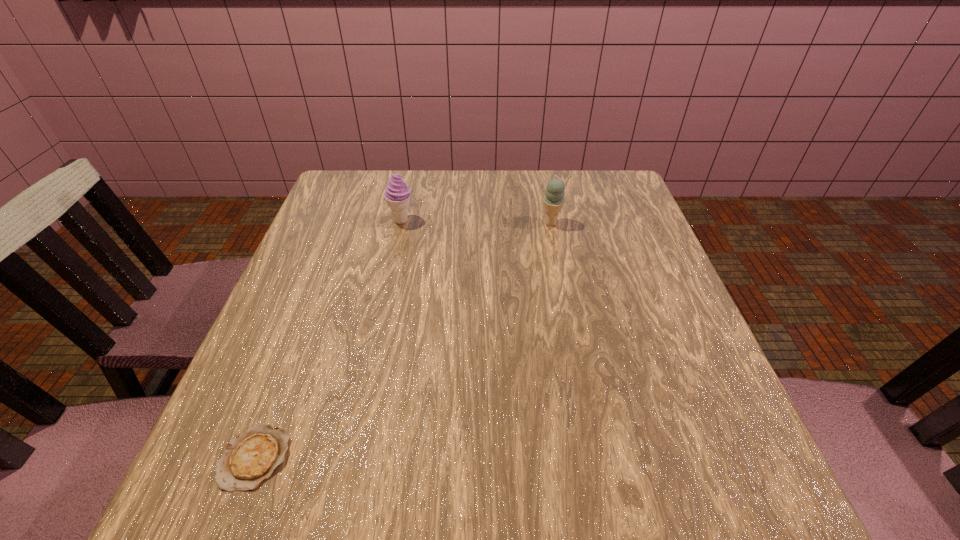
You are a GUI agent. You are given a task and a screenshot of the screen. Output one action in this format:
    pyautogui.click(x=<x>, y=<y>)
    Task: Click on the second object from left to right
    This screenshot has height=540, width=960.
    Given the screenshot: What is the action you would take?
    pyautogui.click(x=397, y=195)

Image resolution: width=960 pixels, height=540 pixels. I want to click on the right ice cream, so click(x=553, y=200).

Where is `the shortest object`? The width and height of the screenshot is (960, 540). the shortest object is located at coordinates (250, 458).

This screenshot has height=540, width=960. Identify the location of the leftmost object. (250, 458).

Locate an element on the screen. The height and width of the screenshot is (540, 960). vacant space located on the right of the second object from left to right is located at coordinates (509, 220).

The height and width of the screenshot is (540, 960). Identify the location of free space located on the left of the right ice cream. (516, 223).

Locate an element on the screen. This screenshot has width=960, height=540. vacant space located on the back of the nearest object is located at coordinates (286, 373).

Locate an element on the screen. Image resolution: width=960 pixels, height=540 pixels. object at the near edge is located at coordinates (250, 458).

Image resolution: width=960 pixels, height=540 pixels. What are the coordinates of `object at the left edge` in the screenshot? It's located at (250, 458).

Locate an element on the screen. Image resolution: width=960 pixels, height=540 pixels. object present at the near left corner is located at coordinates (250, 458).